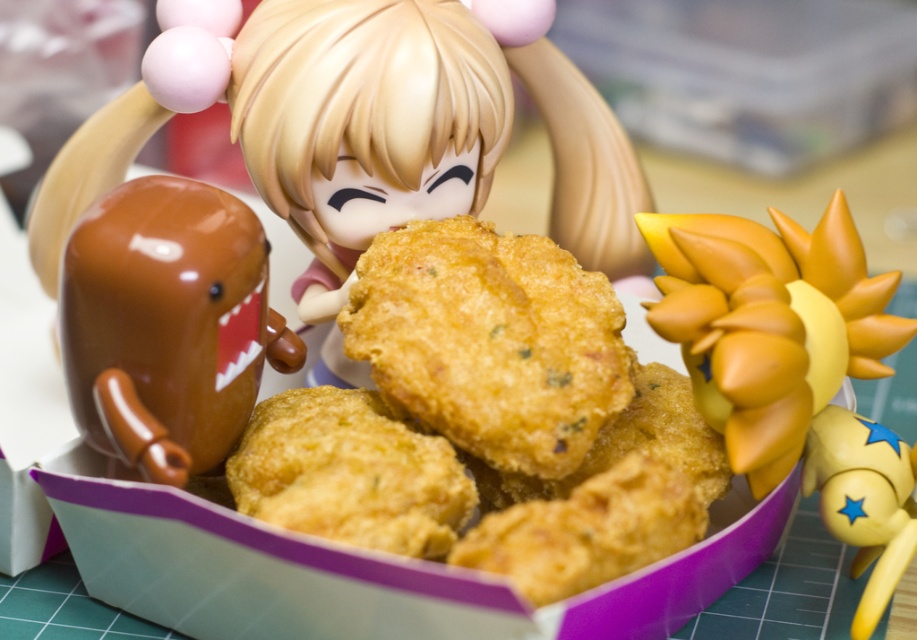
You are a food critic observing the miniature scene. Which object is taller between the golden crispy nuggets at center and the yellow spiky hair at right?

The yellow spiky hair at right is taller than the golden crispy nuggets at center.

You are a food critic observing the miniature scene. You notice the golden crispy nuggets at center and the yellow spiky hair at right. Which object is closer to you in the scene?

The golden crispy nuggets at center are closer to you because they are in front of the yellow spiky hair at right.